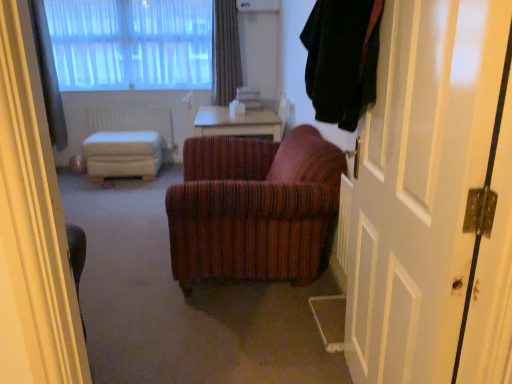
Question: From a real-world perspective, is white sheer curtains at upper left below gray textured curtain at upper center, which is the first curtain in right-to-left order?

Choices:
 (A) yes
 (B) no

Answer: (B)

Question: From the image's perspective, is white sheer curtains at upper left located above gray textured curtain at upper center, which is the first curtain in right-to-left order?

Choices:
 (A) no
 (B) yes

Answer: (B)

Question: Would you consider white sheer curtains at upper left to be distant from gray textured curtain at upper center, which is the first curtain in right-to-left order?

Choices:
 (A) yes
 (B) no

Answer: (B)

Question: Could gray textured curtain at upper center, which is the first curtain in right-to-left order, be considered to be inside white sheer curtains at upper left?

Choices:
 (A) yes
 (B) no

Answer: (B)

Question: Considering the relative sizes of white sheer curtains at upper left and gray textured curtain at upper center, which is the first curtain in right-to-left order, in the image provided, is white sheer curtains at upper left smaller than gray textured curtain at upper center, which is the first curtain in right-to-left order,?

Choices:
 (A) yes
 (B) no

Answer: (B)

Question: Is white sheer curtains at upper left wider than gray textured curtain at upper center, which is the first curtain in right-to-left order?

Choices:
 (A) no
 (B) yes

Answer: (A)

Question: Can you confirm if gray textured curtain at upper center, which is counted as the 2th curtain, starting from the left, is wider than wooden table at center?

Choices:
 (A) yes
 (B) no

Answer: (B)

Question: Is gray textured curtain at upper center, which is the first curtain in right-to-left order, facing towards wooden table at center?

Choices:
 (A) yes
 (B) no

Answer: (A)

Question: Is gray textured curtain at upper center, which is counted as the 2th curtain, starting from the left, thinner than wooden table at center?

Choices:
 (A) yes
 (B) no

Answer: (A)

Question: From a real-world perspective, is gray textured curtain at upper center, which is the first curtain in right-to-left order, positioned under wooden table at center based on gravity?

Choices:
 (A) no
 (B) yes

Answer: (A)

Question: Are gray textured curtain at upper center, which is the first curtain in right-to-left order, and wooden table at center beside each other?

Choices:
 (A) yes
 (B) no

Answer: (B)

Question: Is gray textured curtain at upper center, which is the first curtain in right-to-left order, smaller than wooden table at center?

Choices:
 (A) yes
 (B) no

Answer: (A)

Question: Are white wooden door at right and white plastic radiator at center located far from each other?

Choices:
 (A) no
 (B) yes

Answer: (B)